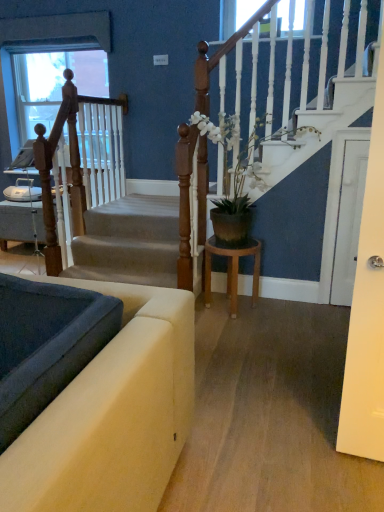
The height and width of the screenshot is (512, 384). Describe the element at coordinates (246, 173) in the screenshot. I see `white matte plant pot at center` at that location.

Find the location of a particular element. smooth gray carpet at lower left is located at coordinates (46, 344).

Looking at this image, from the image's perspective, would you say smooth gray carpet at lower left is positioned over wooden at left?

No, from the image's perspective, smooth gray carpet at lower left is not on top of wooden at left.

Which is less distant, (x=65, y=362) or (x=36, y=143)?

Point (x=65, y=362)

Does smooth gray carpet at lower left turn towards wooden at left?

No, smooth gray carpet at lower left does not turn towards wooden at left.

Is smooth gray carpet at lower left not inside wooden at left?

smooth gray carpet at lower left is positioned outside wooden at left.

In the scene shown: From a real-world perspective, who is located lower, smooth gray carpet at lower left or wooden stool at center?

wooden stool at center.

The width and height of the screenshot is (384, 512). In the image, there is a wooden stool at center. In order to click on landing below it (from the image's perspective) in this screenshot , I will do `click(46, 344)`.

Can you confirm if smooth gray carpet at lower left is wider than wooden stool at center?

In fact, smooth gray carpet at lower left might be narrower than wooden stool at center.

Between smooth gray carpet at lower left and wooden stool at center, which one has more height?

Standing taller between the two is wooden stool at center.

Based on their sizes in the image, would you say wooden at left is bigger or smaller than wooden stool at center?

wooden at left is bigger than wooden stool at center.

Would you say wooden at left is to the left or to the right of wooden stool at center in the picture?

From the image, it's evident that wooden at left is to the left of wooden stool at center.

Does wooden at left have a lesser height compared to wooden stool at center?

Incorrect, the height of wooden at left does not fall short of that of wooden stool at center.

Consider the image. From a real-world perspective, is wooden at left physically located above or below wooden stool at center?

From a real-world perspective, wooden at left is physically above wooden stool at center.

Does white matte plant pot at center touch wooden stool at center?

No, white matte plant pot at center is not beside wooden stool at center.

Would you say white matte plant pot at center contains wooden stool at center?

No.

Considering the relative sizes of white matte plant pot at center and wooden stool at center in the image provided, is white matte plant pot at center taller than wooden stool at center?

Indeed, white matte plant pot at center has a greater height compared to wooden stool at center.

From the image's perspective, which one is positioned higher, white matte plant pot at center or wooden stool at center?

white matte plant pot at center appears higher in the image.

Can you confirm if white glossy door at right is thinner than smooth gray carpet at lower left?

Yes, white glossy door at right is thinner than smooth gray carpet at lower left.

Between white glossy door at right and smooth gray carpet at lower left, which one appears on the left side from the viewer's perspective?

Positioned to the left is smooth gray carpet at lower left.

From a real-world perspective, is white glossy door at right under smooth gray carpet at lower left?

Actually, white glossy door at right is physically above smooth gray carpet at lower left in the real world.

Is white glossy door at right bigger than smooth gray carpet at lower left?

Actually, white glossy door at right might be smaller than smooth gray carpet at lower left.

What's the angular difference between wooden at left and velvet beige sofa at lower left's facing directions?

180 degrees.

Is wooden at left turned away from velvet beige sofa at lower left?

No, wooden at left is not facing the opposite direction of velvet beige sofa at lower left.

From a real-world perspective, relative to velvet beige sofa at lower left, is wooden at left vertically above or below?

Clearly, from a real-world perspective, wooden at left is above velvet beige sofa at lower left.

Based on the photo, from a real-world perspective, is velvet beige sofa at lower left on white glossy door at right?

No, from a real-world perspective, velvet beige sofa at lower left is not over white glossy door at right

The width and height of the screenshot is (384, 512). In order to click on studio couch on the left of white glossy door at right in this screenshot , I will do `click(112, 414)`.

From the image's perspective, would you say velvet beige sofa at lower left is shown under white glossy door at right?

Indeed, from the image's perspective, velvet beige sofa at lower left is shown beneath white glossy door at right.

Where is `rail on the left of smooth gray carpet at lower left`? rail on the left of smooth gray carpet at lower left is located at coordinates (80, 166).

Find the location of a particular element. The image size is (384, 512). landing below the wooden stool at center (from the image's perspective) is located at coordinates (46, 344).

Looking at the image, which one is located closer to white matte plant pot at center, velvet beige sofa at lower left or white glossy door at right?

Among the two, white glossy door at right is located nearer to white matte plant pot at center.

Looking at the image, which one is located further to wooden stool at center, smooth gray carpet at lower left or velvet beige sofa at lower left?

smooth gray carpet at lower left lies further to wooden stool at center than the other object.

Which object lies nearer to the anchor point wooden at left, velvet beige sofa at lower left or smooth gray carpet at lower left?

velvet beige sofa at lower left lies closer to wooden at left than the other object.

Considering their positions, is smooth gray carpet at lower left positioned further to wooden at left than white glossy door at right?

Among the two, smooth gray carpet at lower left is located further to wooden at left.

Considering their positions, is wooden stool at center positioned closer to velvet beige sofa at lower left than white glossy door at right?

The object closer to velvet beige sofa at lower left is wooden stool at center.

In the scene shown: Which object lies further to the anchor point smooth gray carpet at lower left, velvet beige sofa at lower left or wooden at left?

Based on the image, wooden at left appears to be further to smooth gray carpet at lower left.

Estimate the real-world distances between objects in this image. Which object is closer to white matte plant pot at center, wooden stool at center or velvet beige sofa at lower left?

wooden stool at center.

Looking at the image, which one is located closer to smooth gray carpet at lower left, wooden at left or white matte plant pot at center?

white matte plant pot at center lies closer to smooth gray carpet at lower left than the other object.

Identify the location of landing between wooden at left and white glossy door at right in the horizontal direction. Image resolution: width=384 pixels, height=512 pixels. (46, 344).

This screenshot has height=512, width=384. I want to click on houseplant located between velvet beige sofa at lower left and wooden stool at center in the depth direction, so click(x=246, y=173).

Image resolution: width=384 pixels, height=512 pixels. In order to click on landing located between velvet beige sofa at lower left and white glossy door at right in the depth direction in this screenshot , I will do `click(46, 344)`.

I want to click on table between smooth gray carpet at lower left and white glossy door at right, so click(232, 268).